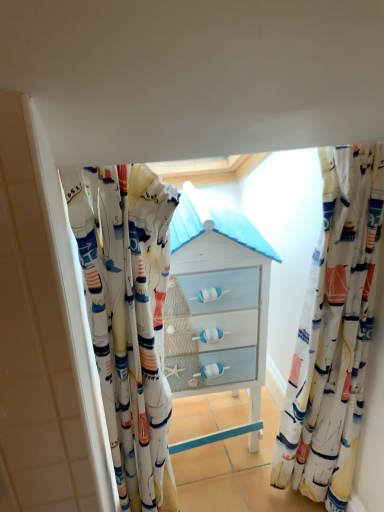
At what (x,y) coordinates should I click in order to perform the action: click on vacant space to the left of sailboat-patterned fabric at right, which ranks as the second curtain in left-to-right order. Please return your answer as a coordinate pair (x, y). Looking at the image, I should click on (254, 487).